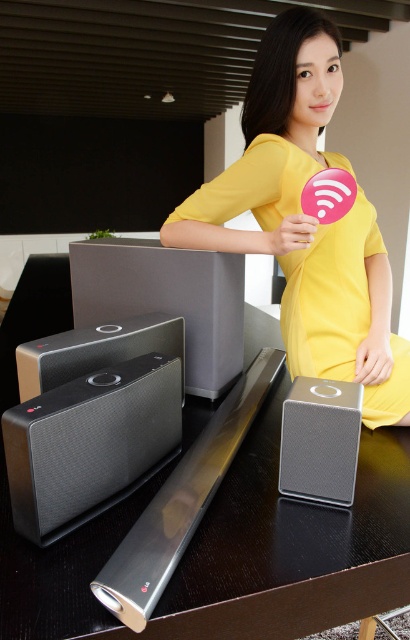
Question: Estimate the real-world distances between objects in this image. Which object is closer to the black glossy table at center?

Choices:
 (A) matte black speaker at center
 (B) textured gray speaker at lower left

Answer: (B)

Question: From the image, what is the correct spatial relationship of black glossy table at center in relation to satin black speaker at center?

Choices:
 (A) below
 (B) above

Answer: (A)

Question: Does textured gray speaker at lower left have a smaller size compared to matte black speaker at center?

Choices:
 (A) yes
 (B) no

Answer: (A)

Question: Which of the following is the closest to the observer?

Choices:
 (A) yellow fabric dress at center
 (B) matte black speaker at lower left
 (C) satin black speaker at center

Answer: (C)

Question: Which object appears closest to the camera in this image?

Choices:
 (A) satin black speaker at center
 (B) yellow fabric dress at center
 (C) black glossy table at center
 (D) matte black speaker at lower left

Answer: (C)

Question: Can you confirm if black glossy table at center is bigger than matte black speaker at lower left?

Choices:
 (A) no
 (B) yes

Answer: (B)